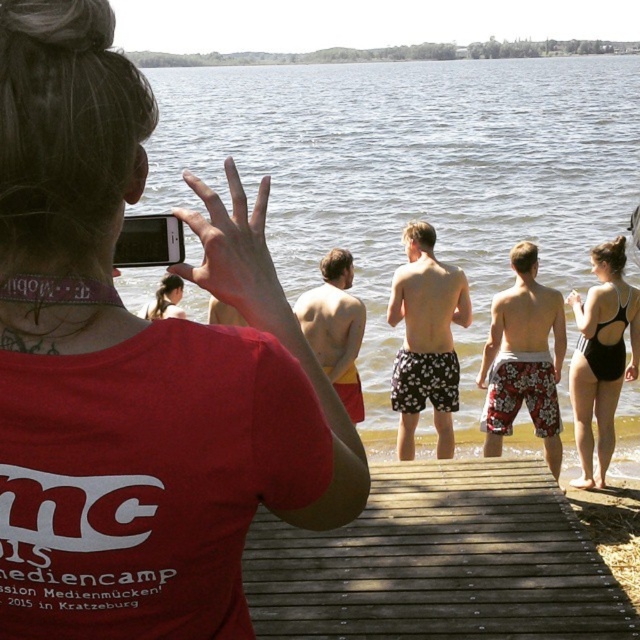
Can you confirm if floral-patterned shorts at center is positioned above black swimsuit at right?

Yes, floral-patterned shorts at center is above black swimsuit at right.

Where is `floral-patterned shorts at center`? This screenshot has width=640, height=640. floral-patterned shorts at center is located at coordinates (426, 339).

You are a GUI agent. You are given a task and a screenshot of the screen. Output one action in this format:
    pyautogui.click(x=<x>, y=<y>)
    Task: Click on the floral-patterned shorts at center
    This screenshot has width=640, height=640.
    Given the screenshot: What is the action you would take?
    pyautogui.click(x=426, y=339)

Does matte red t-shirt at center have a lesser height compared to dark brown wooden dock at center?

No.

Can you confirm if matte red t-shirt at center is positioned to the left of dark brown wooden dock at center?

Indeed, matte red t-shirt at center is positioned on the left side of dark brown wooden dock at center.

This screenshot has width=640, height=640. I want to click on matte red t-shirt at center, so click(x=136, y=369).

Identify the location of matte red t-shirt at center. point(136,369).

Measure the distance between matte red t-shirt at center and camera.

A distance of 4.82 feet exists between matte red t-shirt at center and camera.

Which is more to the right, matte red t-shirt at center or clear water at center?

clear water at center

Which is in front, point (33, 356) or point (538, 125)?

Point (33, 356)

Find the location of a particular element. Image resolution: width=640 pixels, height=640 pixels. matte red t-shirt at center is located at coordinates (136, 369).